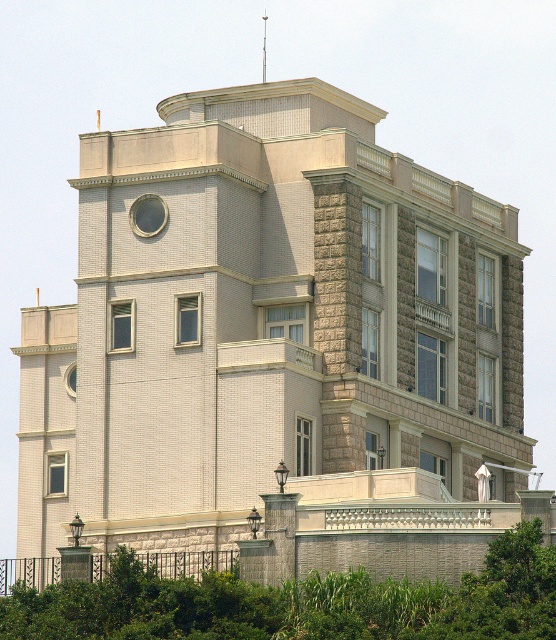
You are standing in front of the building and notice the green leafy tree at lower center and the metallic spire at upper center. Which object is positioned higher up on the building?

The metallic spire at upper center is positioned higher up on the building than the green leafy tree at lower center.

You are standing in front of the building and want to determine the location of two points marked on the facade. Based on the image, which of the two points, point 1 at coordinates point [295,595] or point 2 at coordinates point [264,24], is closer to you?

Point 1 at coordinates point [295,595] is closer to the viewer than point 2 at coordinates point [264,24].

You are standing in front of the building and want to take a photo that includes both the green leafy tree at lower center and the metallic spire at upper center. Which object should you focus on first to ensure both are in clear view?

You should focus on the green leafy tree at lower center first because it is closer to the viewer than the metallic spire at upper center, so adjusting focus from near to far will help both be in clear view.